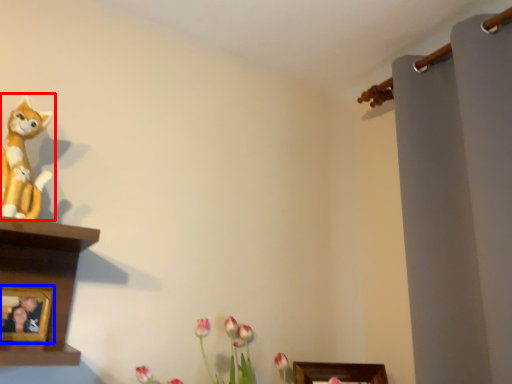
Question: Which object appears closest to the camera in this image, toy (highlighted by a red box) or picture frame (highlighted by a blue box)?

Choices:
 (A) toy
 (B) picture frame

Answer: (A)